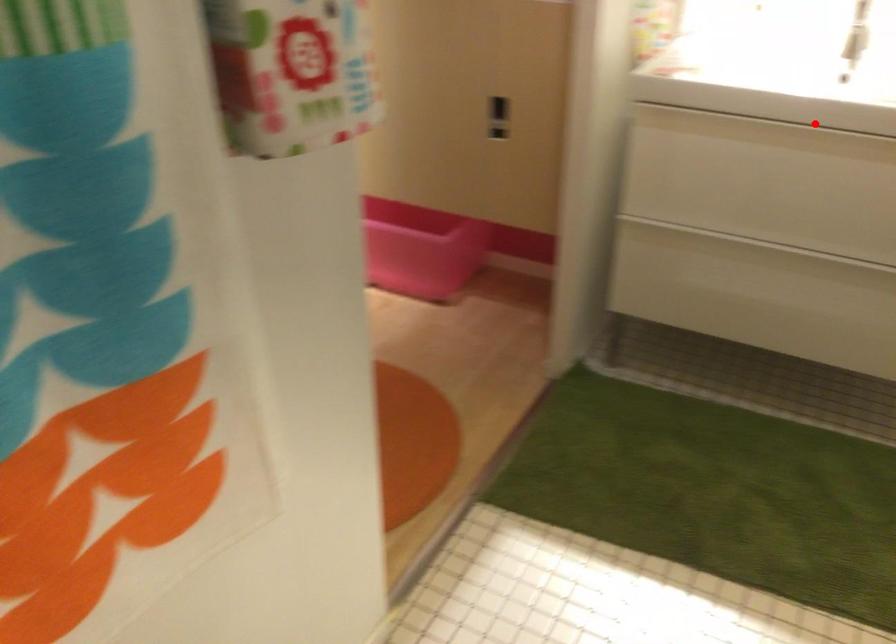
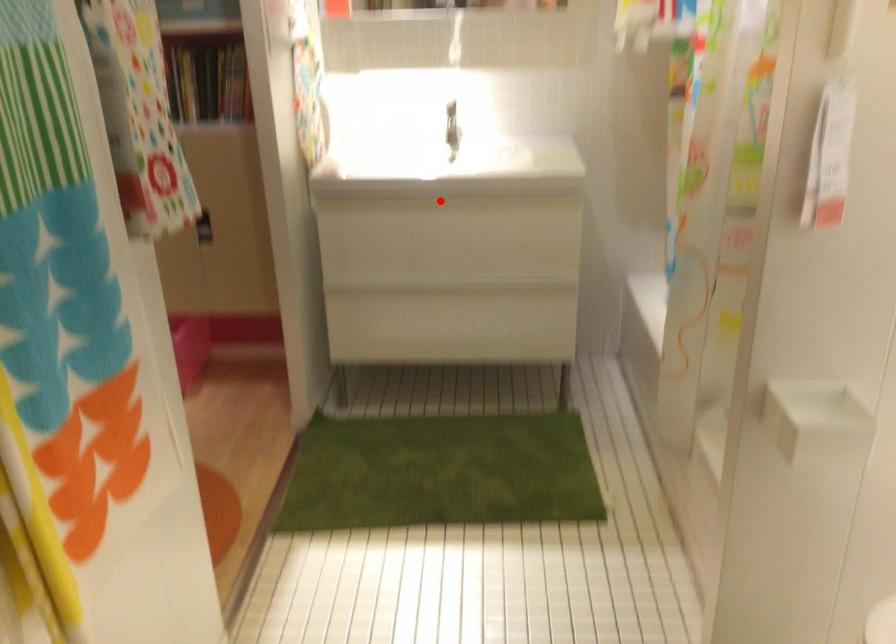
I am providing you with two images of the same scene from different viewpoints. A red point is marked on the first image and another point is marked on the second image. Is the red point in image1 aligned with the point shown in image2?

Yes